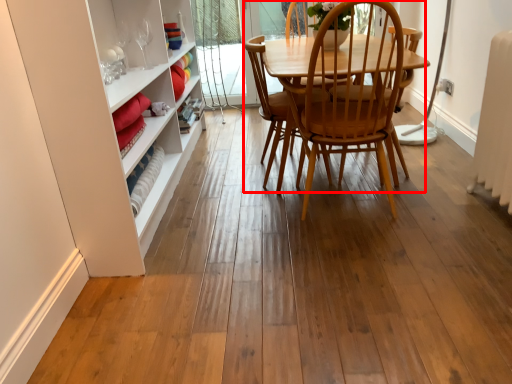
Question: From the image, what is the correct spatial relationship of chair (annotated by the red box) in relation to armchair?

Choices:
 (A) right
 (B) left

Answer: (A)